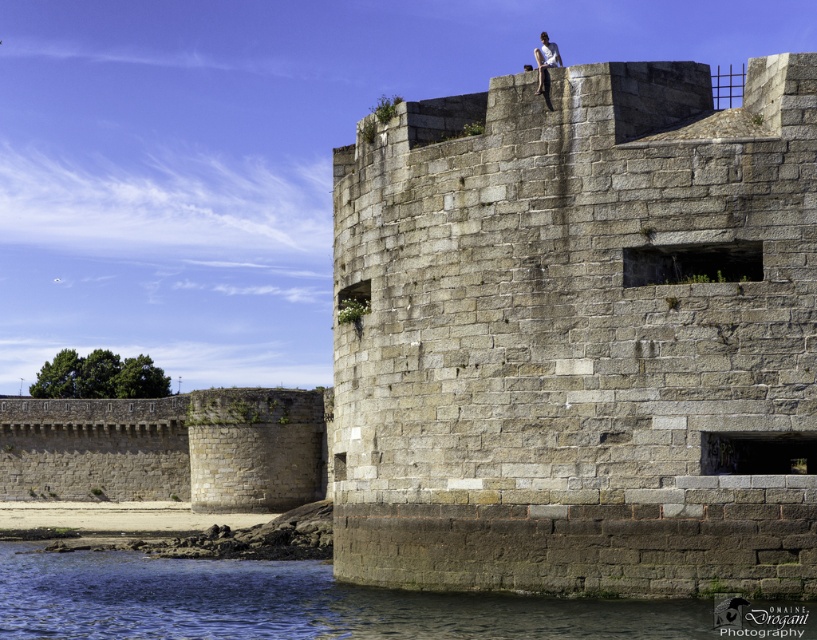
Is gray stone wall at upper center wider than white fabric shirt at upper center?

Yes.

What do you see at coordinates (581, 337) in the screenshot? This screenshot has height=640, width=817. I see `gray stone wall at upper center` at bounding box center [581, 337].

Is point (681, 232) positioned before point (552, 54)?

That is True.

The width and height of the screenshot is (817, 640). I want to click on gray stone wall at upper center, so click(x=581, y=337).

Who is more forward, (384, 502) or (2, 628)?

Point (2, 628) is in front.

Between gray stone wall at upper center and blue water at lower left, which one appears on the right side from the viewer's perspective?

Positioned to the right is gray stone wall at upper center.

Is point (565, 467) in front of point (38, 557)?

Yes, point (565, 467) is in front of point (38, 557).

Where is `gray stone wall at upper center`? The image size is (817, 640). gray stone wall at upper center is located at coordinates (581, 337).

Is blue water at lower left in front of white fabric shirt at upper center?

Yes, blue water at lower left is closer to the viewer.

Does blue water at lower left appear over white fabric shirt at upper center?

Actually, blue water at lower left is below white fabric shirt at upper center.

Between point (51, 552) and point (550, 65), which one is positioned behind?

Point (51, 552)

This screenshot has height=640, width=817. I want to click on blue water at lower left, so click(291, 602).